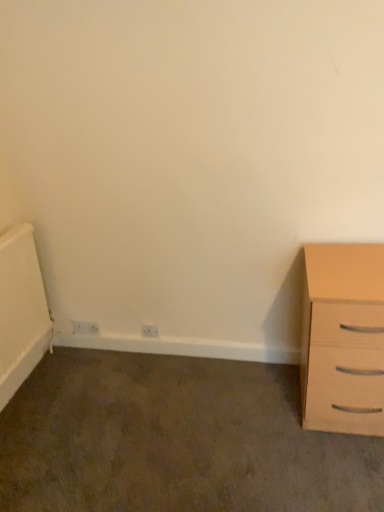
The image size is (384, 512). Find the location of `vacant position to the left of light wood chest of drawers at right`. vacant position to the left of light wood chest of drawers at right is located at coordinates (257, 410).